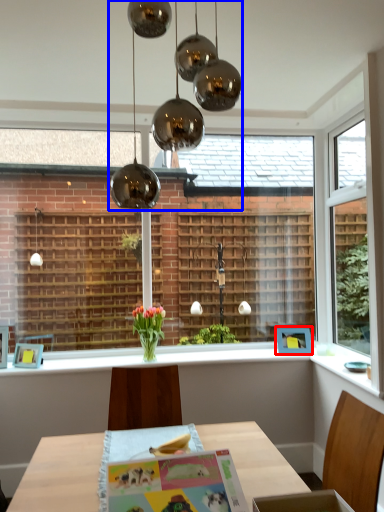
Question: Which of the following is the farthest to the observer, picture frame (highlighted by a red box) or chandelier (highlighted by a blue box)?

Choices:
 (A) picture frame
 (B) chandelier

Answer: (A)